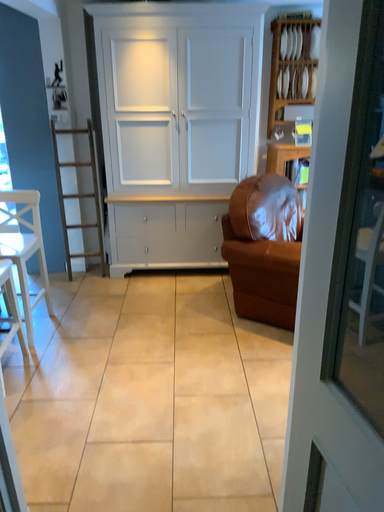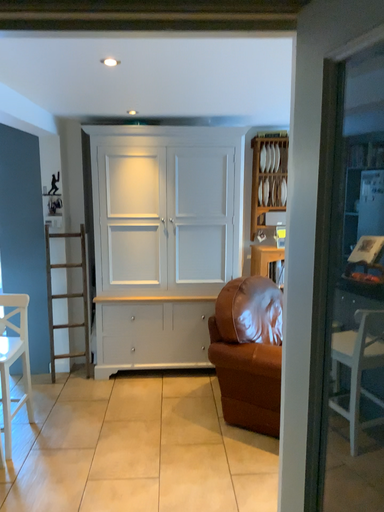
Question: Which way did the camera rotate in the video?

Choices:
 (A) rotated upward
 (B) rotated downward

Answer: (A)